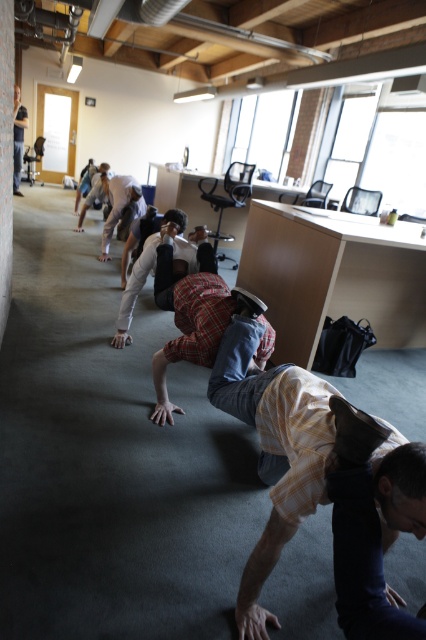
Question: Does yellow plaid shorts at lower center have a smaller size compared to matte black laptop at upper left?

Choices:
 (A) yes
 (B) no

Answer: (A)

Question: Where is yellow plaid shorts at lower center located in relation to matte black laptop at upper left in the image?

Choices:
 (A) left
 (B) right

Answer: (B)

Question: Among these points, which one is nearest to the camera?

Choices:
 (A) (20, 156)
 (B) (215, 364)

Answer: (B)

Question: Is yellow plaid shorts at lower center positioned at the back of matte black laptop at upper left?

Choices:
 (A) no
 (B) yes

Answer: (A)

Question: Which point is closer to the camera?

Choices:
 (A) matte black laptop at upper left
 (B) yellow plaid shorts at lower center

Answer: (B)